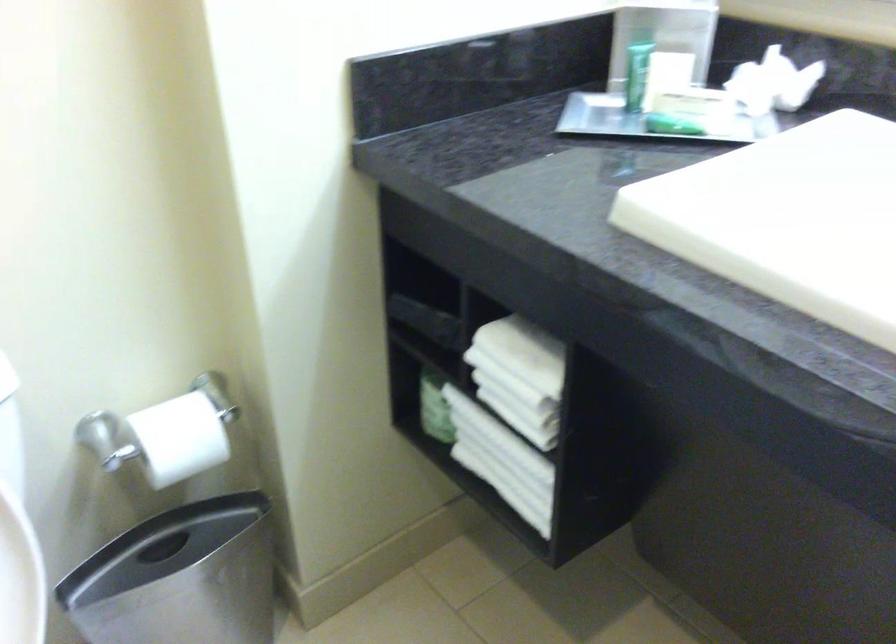
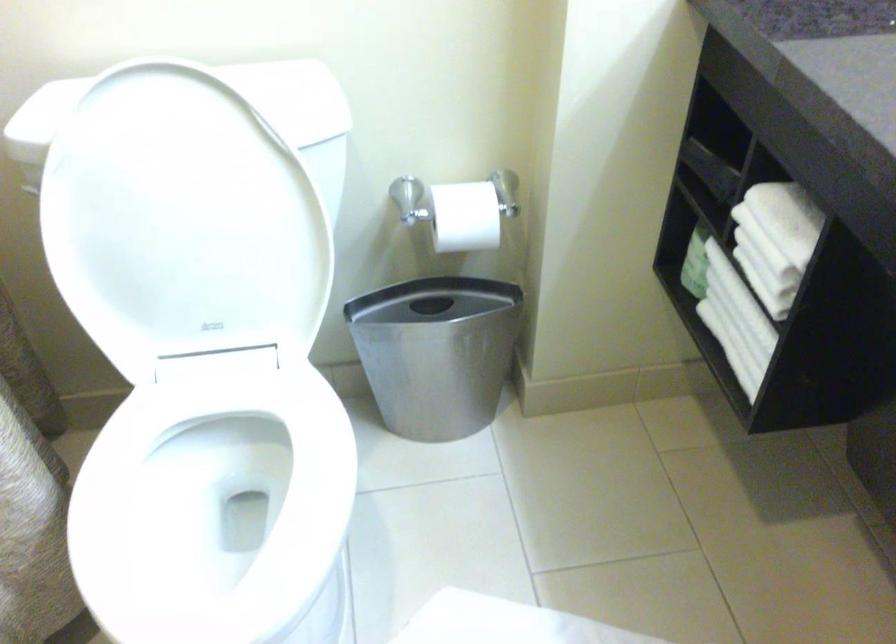
Question: How did the camera likely rotate?

Choices:
 (A) Left
 (B) Right
 (C) Up
 (D) Down

Answer: (A)